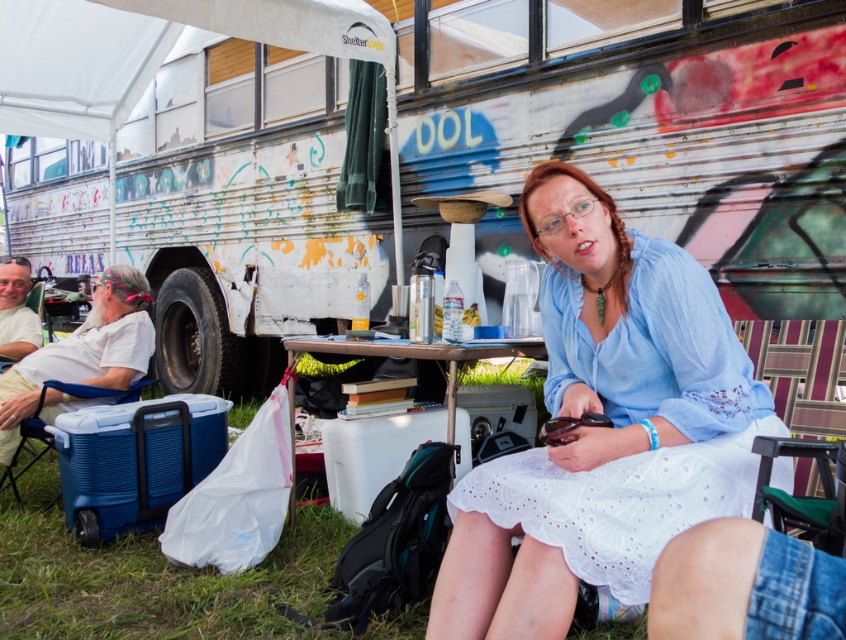
Question: Does wooden table at center have a greater width compared to blue plastic cooler at lower left?

Choices:
 (A) no
 (B) yes

Answer: (B)

Question: Which is nearer to the white painted bus at center?

Choices:
 (A) wooden table at center
 (B) white lace dress at center
 (C) blue plastic cooler at lower left

Answer: (A)

Question: Which of the following is the farthest from the observer?

Choices:
 (A) (498, 628)
 (B) (173, 102)

Answer: (B)

Question: Which object appears farthest from the camera in this image?

Choices:
 (A) blue plastic cooler at lower left
 (B) wooden table at center
 (C) white painted bus at center

Answer: (C)

Question: Does white painted bus at center have a lesser width compared to white lace dress at center?

Choices:
 (A) no
 (B) yes

Answer: (B)

Question: Does wooden table at center have a lesser width compared to blue plastic cooler at lower left?

Choices:
 (A) no
 (B) yes

Answer: (A)